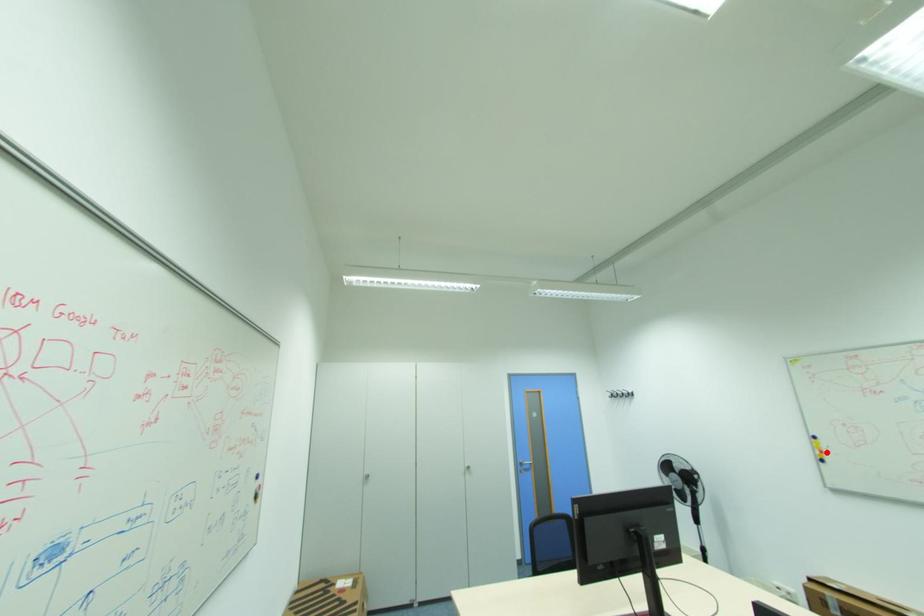
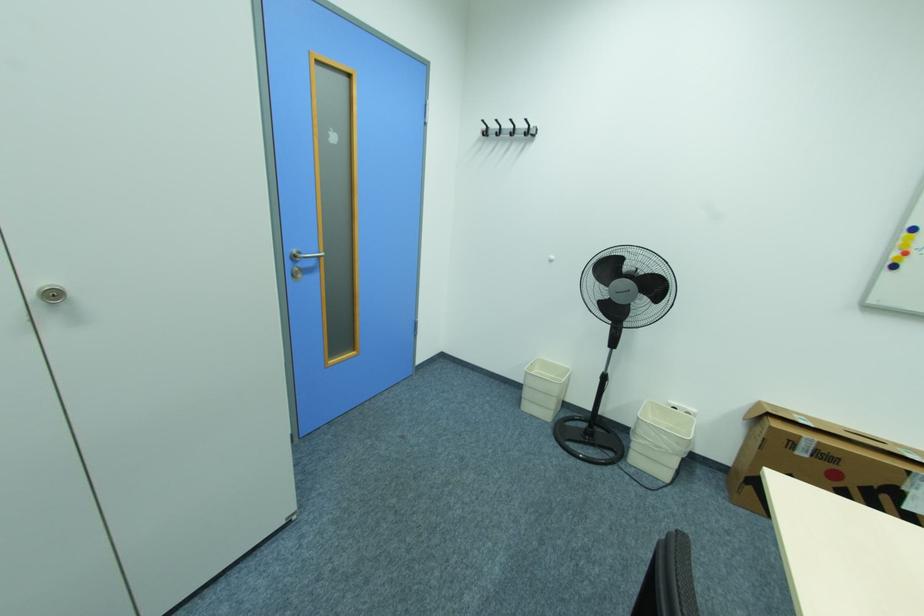
In the second image, find the point that corresponds to the highlighted location in the first image.

(910, 253)